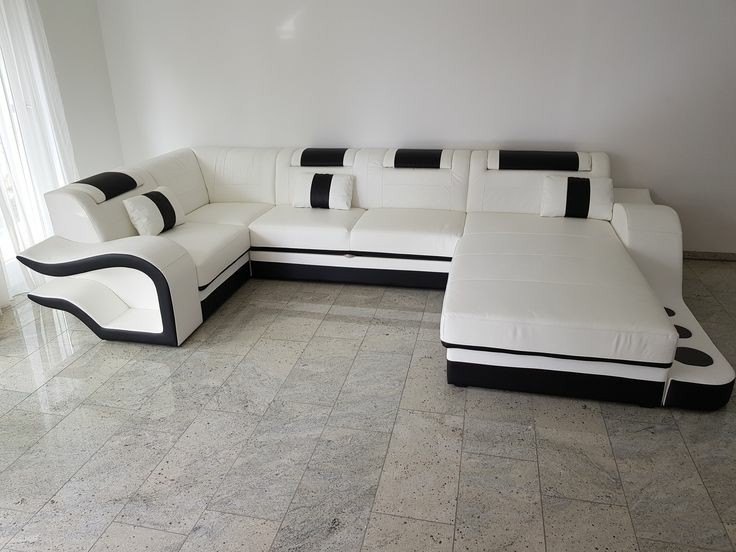
Identify the location of throw pillow. This screenshot has width=736, height=552. (322, 192), (155, 205).